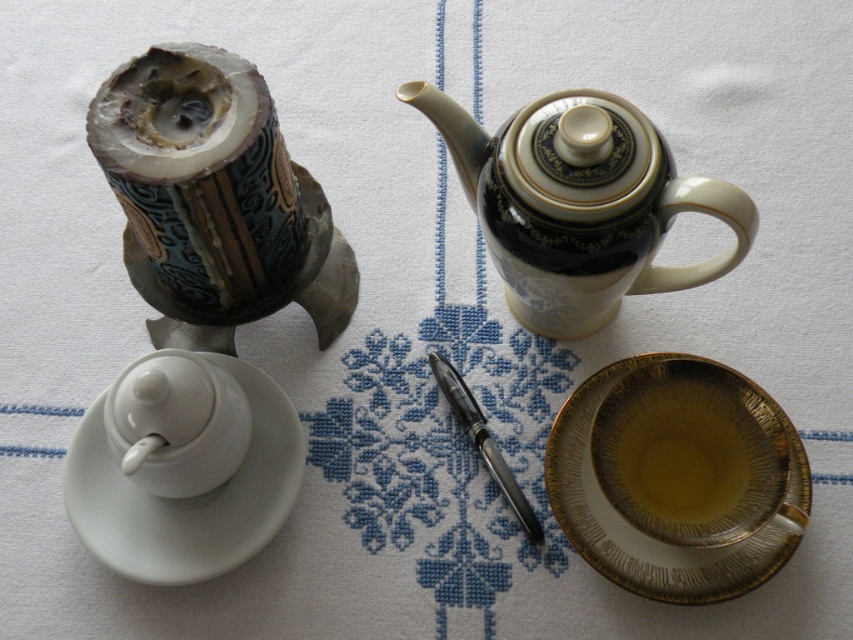
Question: Which point is farther to the camera?

Choices:
 (A) (134, 577)
 (B) (529, 513)

Answer: (B)

Question: Which object is positioned farthest from the white ceramic saucer at lower left?

Choices:
 (A) gold textured saucer at lower right
 (B) black porcelain teapot at upper right
 (C) metallic pen at center

Answer: (A)

Question: Does black porcelain teapot at upper right appear over white ceramic saucer at lower left?

Choices:
 (A) no
 (B) yes

Answer: (B)

Question: Which of the following is the farthest from the observer?

Choices:
 (A) white glossy teacup at lower left
 (B) white ceramic saucer at lower left
 (C) black porcelain teapot at upper right

Answer: (A)

Question: Considering the relative positions of gold textured saucer at lower right and white glossy teacup at lower left in the image provided, where is gold textured saucer at lower right located with respect to white glossy teacup at lower left?

Choices:
 (A) right
 (B) left

Answer: (A)

Question: Can you confirm if gold textured saucer at lower right is bigger than white ceramic saucer at lower left?

Choices:
 (A) no
 (B) yes

Answer: (A)